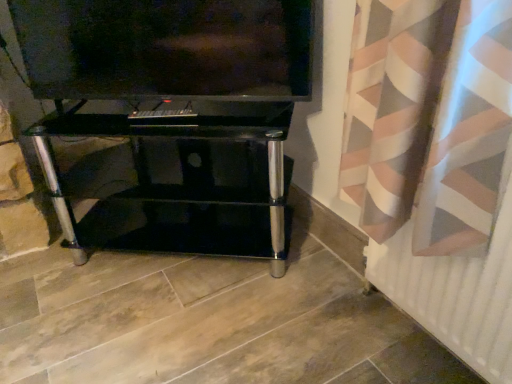
Question: Is white matte radiator at lower right positioned beyond the bounds of black glass tv stand at center?

Choices:
 (A) no
 (B) yes

Answer: (B)

Question: Considering the relative sizes of white matte radiator at lower right and black glass tv stand at center in the image provided, is white matte radiator at lower right bigger than black glass tv stand at center?

Choices:
 (A) no
 (B) yes

Answer: (A)

Question: From the image's perspective, is white matte radiator at lower right located beneath black glass tv stand at center?

Choices:
 (A) no
 (B) yes

Answer: (B)

Question: Considering the relative sizes of white matte radiator at lower right and black glass tv stand at center in the image provided, is white matte radiator at lower right wider than black glass tv stand at center?

Choices:
 (A) no
 (B) yes

Answer: (A)

Question: Is white matte radiator at lower right thinner than black glass tv stand at center?

Choices:
 (A) yes
 (B) no

Answer: (A)

Question: From the image's perspective, is matte black tv at upper center above or below black glass tv stand at center?

Choices:
 (A) above
 (B) below

Answer: (A)

Question: Would you say matte black tv at upper center is to the left or to the right of black glass tv stand at center in the picture?

Choices:
 (A) right
 (B) left

Answer: (A)

Question: In terms of height, does matte black tv at upper center look taller or shorter compared to black glass tv stand at center?

Choices:
 (A) tall
 (B) short

Answer: (B)

Question: Looking at the image, does matte black tv at upper center seem bigger or smaller compared to black glass tv stand at center?

Choices:
 (A) big
 (B) small

Answer: (B)

Question: From a real-world perspective, relative to black glass tv stand at center, is white matte radiator at lower right vertically above or below?

Choices:
 (A) below
 (B) above

Answer: (A)

Question: Looking at their shapes, would you say white matte radiator at lower right is wider or thinner than black glass tv stand at center?

Choices:
 (A) wide
 (B) thin

Answer: (B)

Question: From their relative heights in the image, would you say white matte radiator at lower right is taller or shorter than black glass tv stand at center?

Choices:
 (A) short
 (B) tall

Answer: (A)

Question: Is white matte radiator at lower right in front of or behind black glass tv stand at center in the image?

Choices:
 (A) behind
 (B) front

Answer: (B)

Question: From a real-world perspective, relative to white matte radiator at lower right, is black glass tv stand at center vertically above or below?

Choices:
 (A) below
 (B) above

Answer: (B)

Question: Is black glass tv stand at center inside the boundaries of white matte radiator at lower right, or outside?

Choices:
 (A) outside
 (B) inside

Answer: (A)